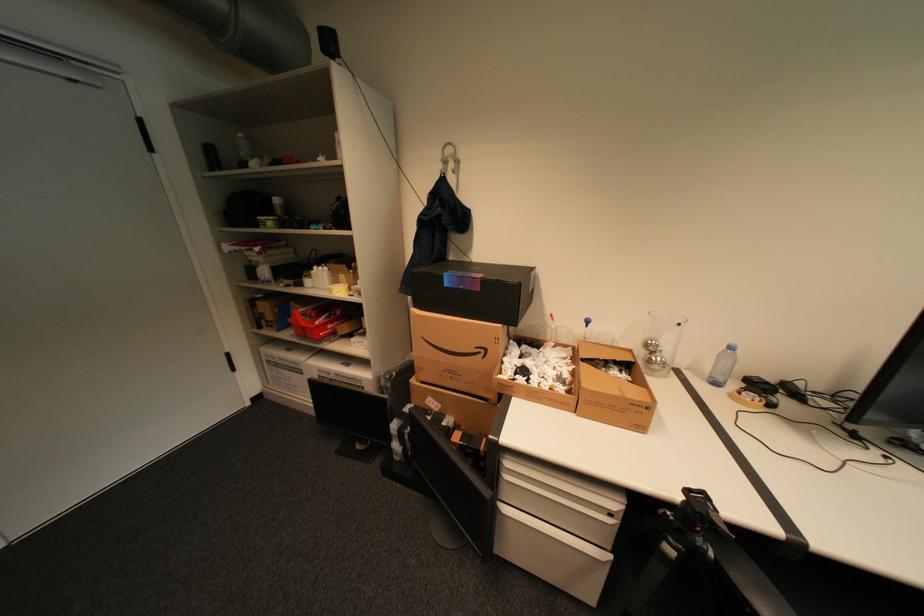
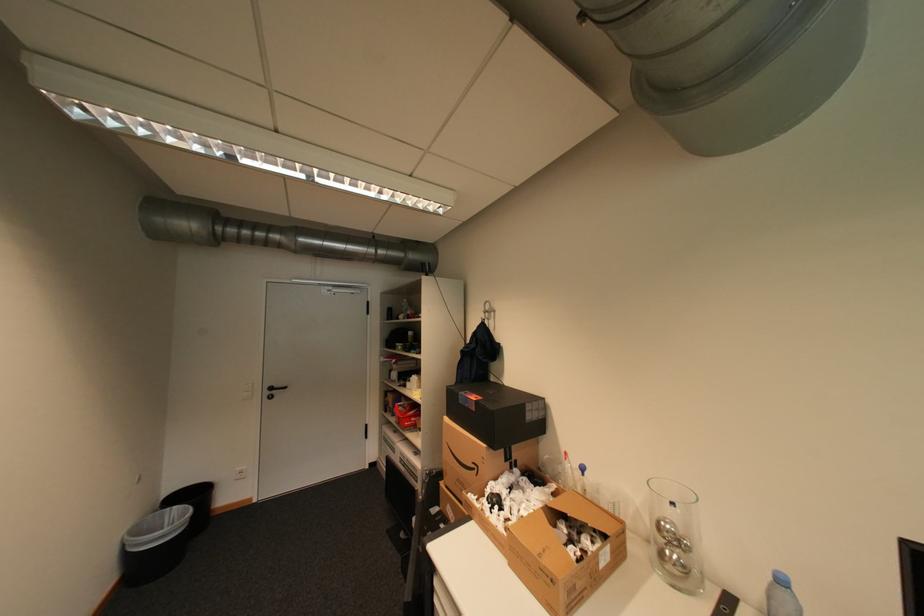
Where in the second image is the point corresponding to point (492, 352) from the first image?

(484, 468)